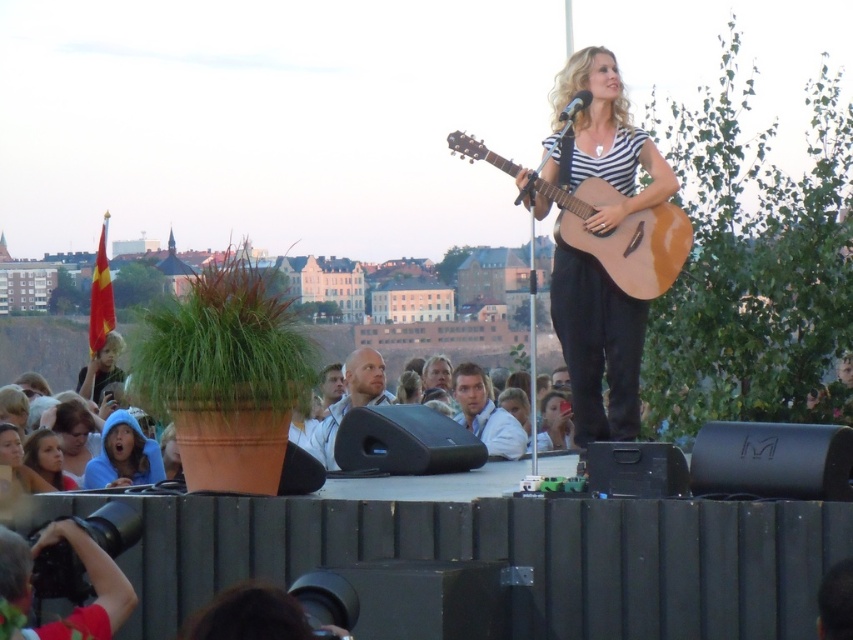
Question: Is blue hoodie at lower left positioned behind smooth skin face at lower left?

Choices:
 (A) yes
 (B) no

Answer: (B)

Question: Is natural wood acoustic guitar at center thinner than blonde hair at center?

Choices:
 (A) yes
 (B) no

Answer: (B)

Question: Does light blue shirt at center lie behind matte blue shirt at center?

Choices:
 (A) yes
 (B) no

Answer: (B)

Question: Among these objects, which one is nearest to the camera?

Choices:
 (A) blue hoodie at lower left
 (B) matte black guitar at center
 (C) smooth skin face at lower left

Answer: (A)

Question: Which of the following is the closest to the observer?

Choices:
 (A) (347, 394)
 (B) (405, 385)
 (C) (602, 72)
 (D) (543, 400)

Answer: (C)

Question: Among these points, which one is farthest from the camera?

Choices:
 (A) (538, 444)
 (B) (120, 458)

Answer: (A)